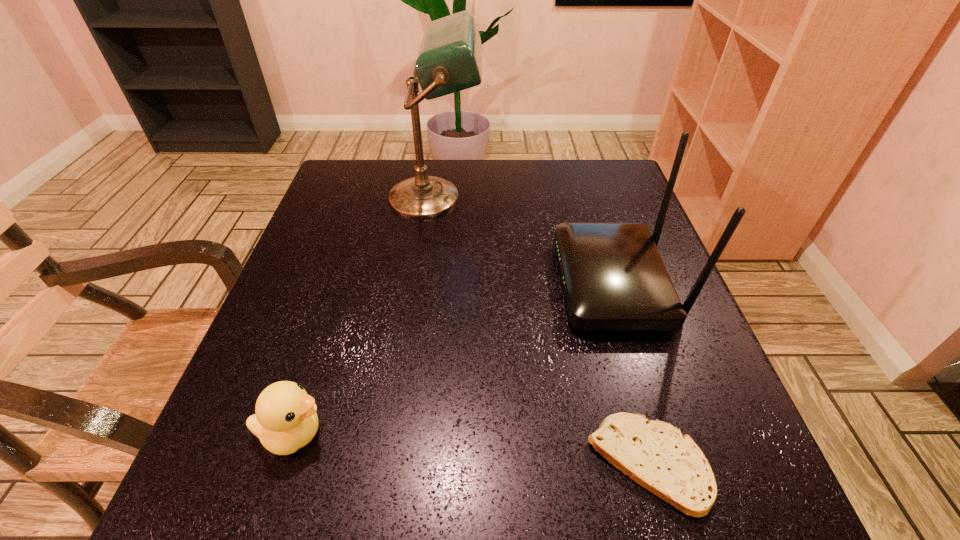
Where is `vacant space at the far edge`? Image resolution: width=960 pixels, height=540 pixels. vacant space at the far edge is located at coordinates pos(527,162).

I want to click on free space at the near edge of the desktop, so click(x=553, y=469).

In the image, there is a desktop. Where is `vacant area at the left edge`? The width and height of the screenshot is (960, 540). vacant area at the left edge is located at coordinates (332, 345).

You are a GUI agent. You are given a task and a screenshot of the screen. Output one action in this format:
    pyautogui.click(x=<x>, y=<y>)
    Task: Click on the vacant space at the right edge of the desktop
    The width and height of the screenshot is (960, 540).
    Given the screenshot: What is the action you would take?
    pyautogui.click(x=731, y=452)

This screenshot has height=540, width=960. I want to click on vacant space at the near right corner, so click(x=701, y=517).

This screenshot has height=540, width=960. I want to click on vacant area that lies between the farthest object and the third nearest object, so click(x=524, y=240).

At what (x,y) coordinates should I click in order to perform the action: click on free space that is in between the second shortest object and the table lamp. Please return your answer as a coordinate pair (x, y). Image resolution: width=960 pixels, height=540 pixels. Looking at the image, I should click on (364, 315).

Where is `blank region between the second shortest object and the tallest object`? blank region between the second shortest object and the tallest object is located at coordinates (364, 315).

Identify the location of free space between the duck and the pita bread. (470, 448).

Where is `free space between the third tallest object and the router`? This screenshot has width=960, height=540. free space between the third tallest object and the router is located at coordinates (453, 359).